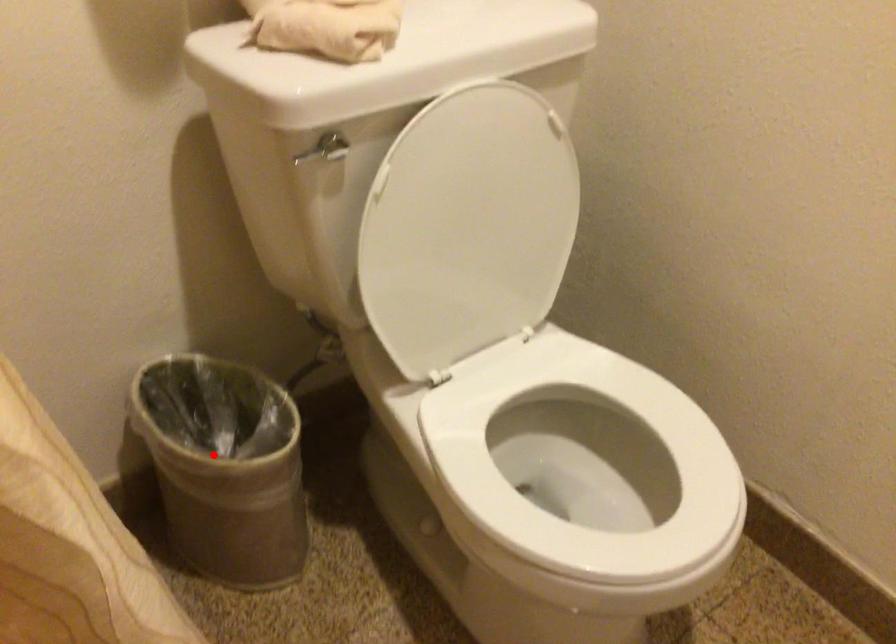
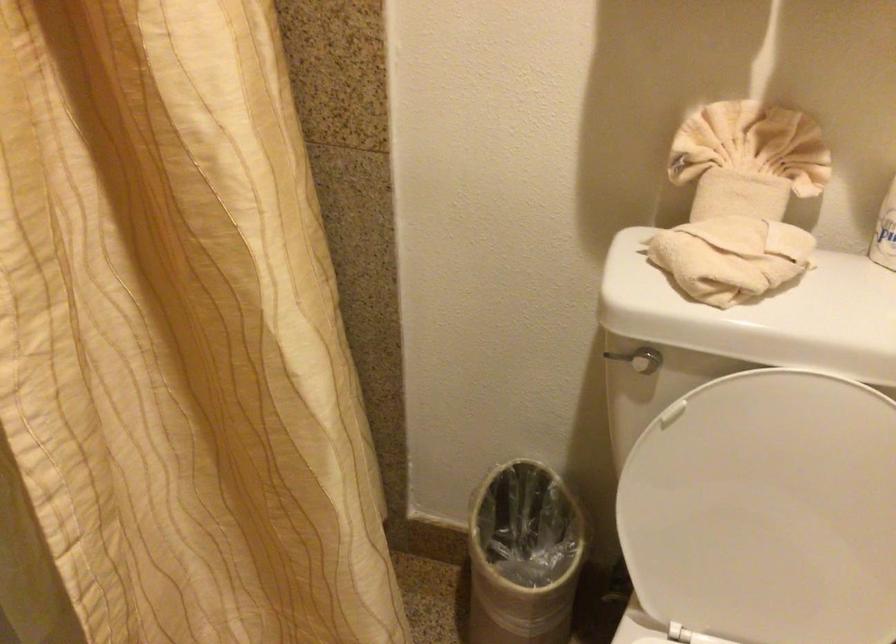
In the second image, find the point that corresponds to the highlighted location in the first image.

(522, 556)